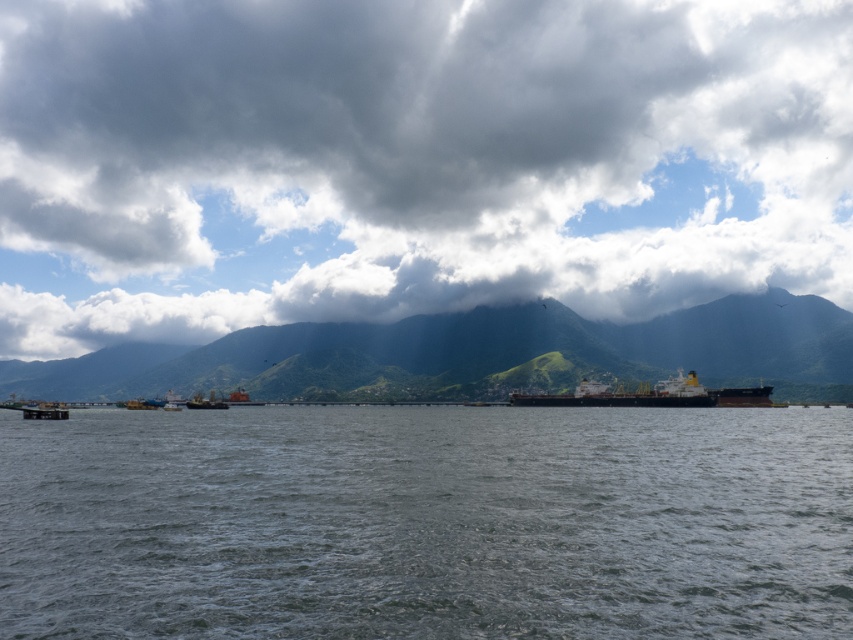
Question: Can you confirm if gray water at center is smaller than metallic gray boat at lower left?

Choices:
 (A) no
 (B) yes

Answer: (B)

Question: Does gray water at center appear under green grassy mountain at center?

Choices:
 (A) no
 (B) yes

Answer: (A)

Question: Which point is farther to the camera?

Choices:
 (A) (65, 417)
 (B) (788, 392)
 (C) (482, 29)
 (D) (463, 628)

Answer: (C)

Question: Is cloudy sky at upper center below metallic gray boat at lower left?

Choices:
 (A) no
 (B) yes

Answer: (A)

Question: Which point is farther from the camera taking this photo?

Choices:
 (A) (28, 412)
 (B) (218, 408)

Answer: (B)

Question: Which object appears closest to the camera in this image?

Choices:
 (A) black matte cargo ship at center
 (B) green grassy mountain at center
 (C) cloudy sky at upper center
 (D) metallic gray boat at center

Answer: (A)